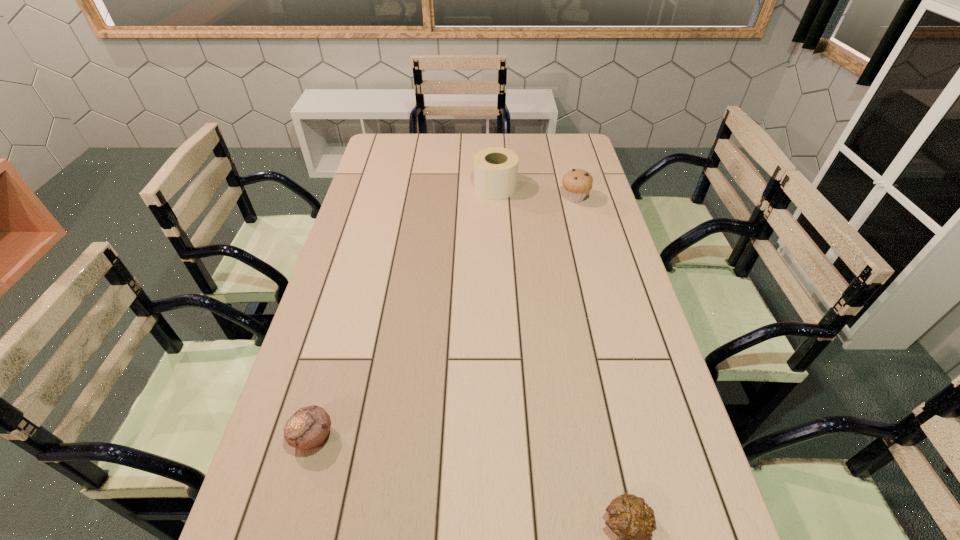
Find the location of a particular element. Image resolution: width=960 pixels, height=540 pixels. the second closest object to the nearest muffin is located at coordinates (577, 183).

Locate an element on the screen. muffin identified as the second closest to the second tallest object is located at coordinates click(x=307, y=429).

Find the location of a particular element. muffin that is the second closest to the third object from right to left is located at coordinates (307, 429).